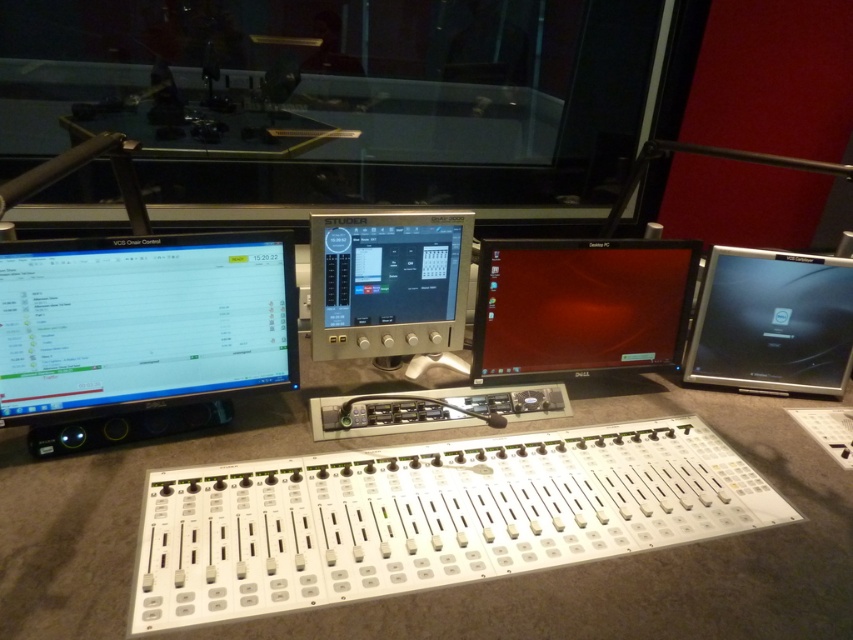
You are a sound engineer adjusting the mixing console. You need to reach two points on the setup for calibration. The first point is at coordinate point(407, 227) and the second is at point(833, 360). Which point will require you to reach further away from your current position?

Point(833, 360) is further away from the camera than point(407, 227), so you will need to reach further to adjust point(833, 360).

You are an audio engineer working on a mixing console setup. You need to adjust the settings displayed on the matte black monitor at left and the matte silver laptop at right. Which device is located to the left of the other?

The matte black monitor at left is positioned on the left side of the matte silver laptop at right, so the matte black monitor at left is to the left of the matte silver laptop at right.